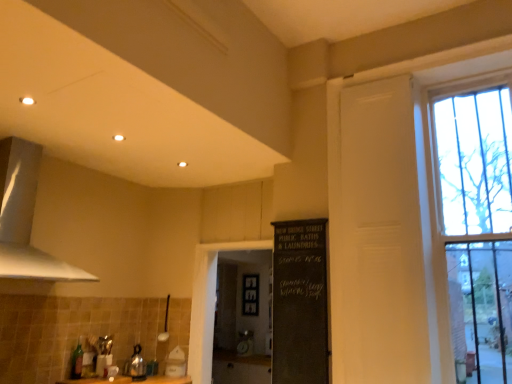
Question: Considering the positions of smooth wooden counter top at center and green glass bottle at lower left in the image, is smooth wooden counter top at center wider or thinner than green glass bottle at lower left?

Choices:
 (A) wide
 (B) thin

Answer: (A)

Question: In the image, is smooth wooden counter top at center on the left side or the right side of green glass bottle at lower left?

Choices:
 (A) left
 (B) right

Answer: (B)

Question: Which object is the closest to the white matte door at right, placed as the 2th screen door when sorted from back to front?

Choices:
 (A) black chalkboard at center
 (B) smooth wooden counter top at center
 (C) black chalkboard at center, which is the 1th screen door in back-to-front order
 (D) white matte exhaust hood at upper left
 (E) white painted wood window at upper right

Answer: (A)

Question: Which of these objects is positioned closest to the white painted wood window at upper right?

Choices:
 (A) white matte door at right, acting as the 1th screen door starting from the right
 (B) white matte exhaust hood at upper left
 (C) black chalkboard at center, which is counted as the second screen door, starting from the front
 (D) green glass bottle at lower left
 (E) black chalkboard at center

Answer: (A)